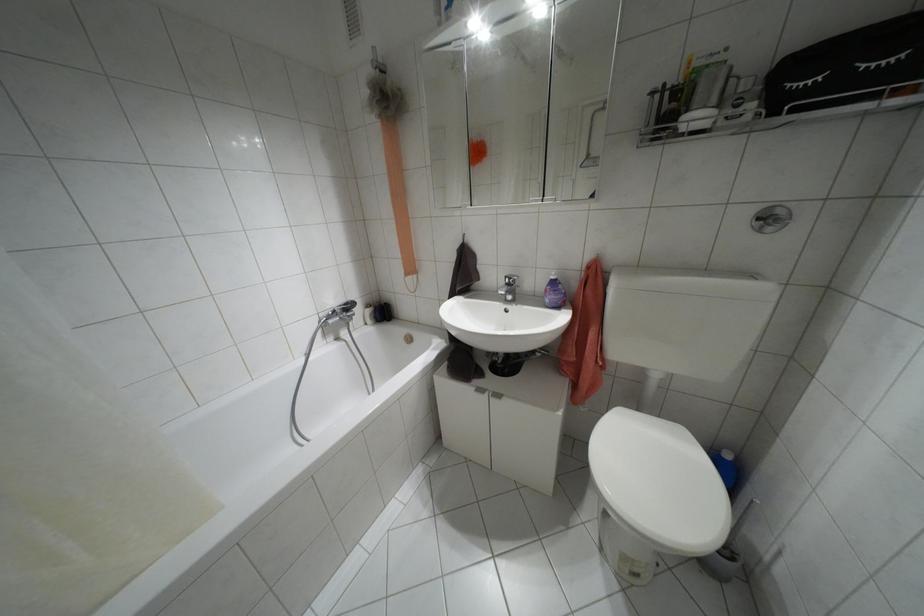
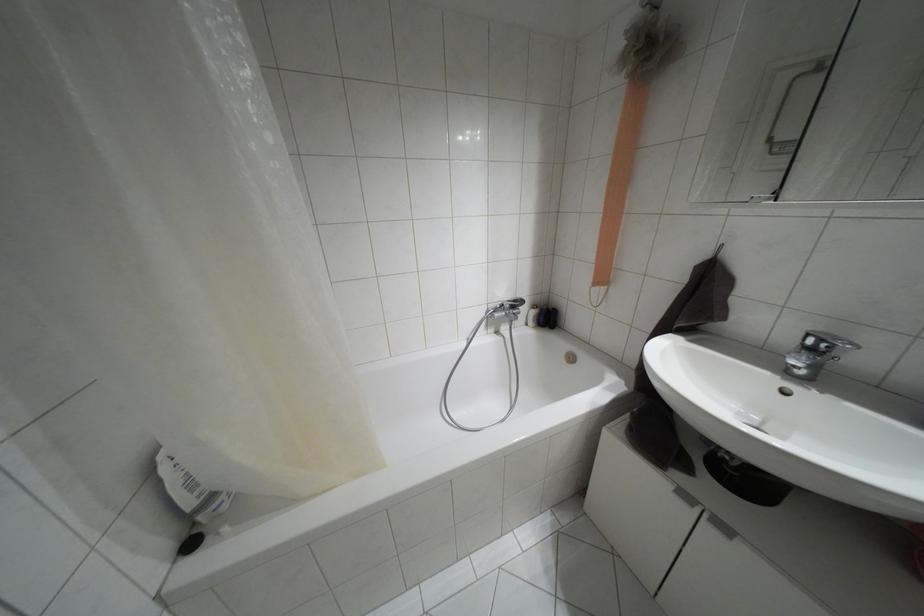
Where in the second image is the point corresponding to pixel 383 312 from the first image?

(546, 317)